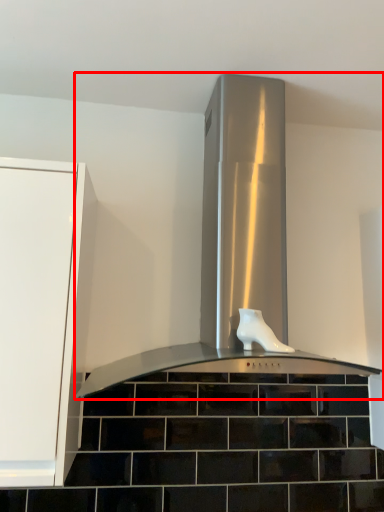
Question: From the image's perspective, where is home appliance (annotated by the red box) located relative to footwear?

Choices:
 (A) below
 (B) above

Answer: (B)